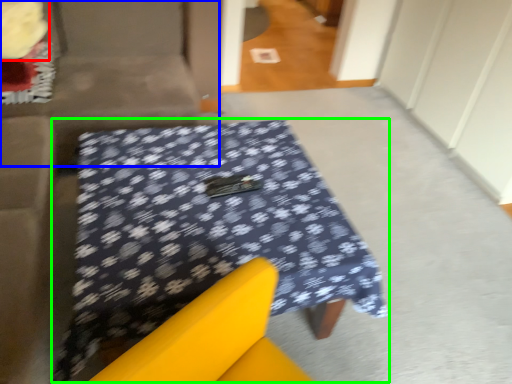
Question: Estimate the real-world distances between objects in this image. Which object is farther from flower (highlighted by a red box), couch (highlighted by a blue box) or table (highlighted by a green box)?

Choices:
 (A) couch
 (B) table

Answer: (B)